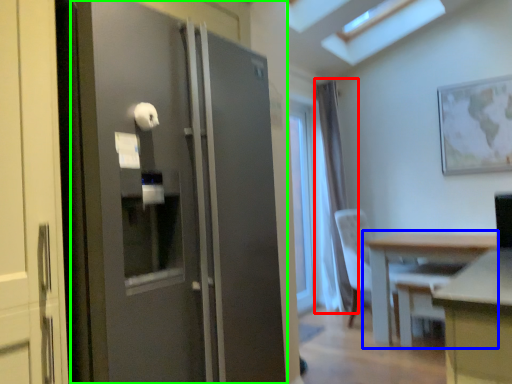
Question: Considering the real-world distances, which object is farthest from curtain (highlighted by a red box)? table (highlighted by a blue box) or door (highlighted by a green box)?

Choices:
 (A) table
 (B) door

Answer: (B)